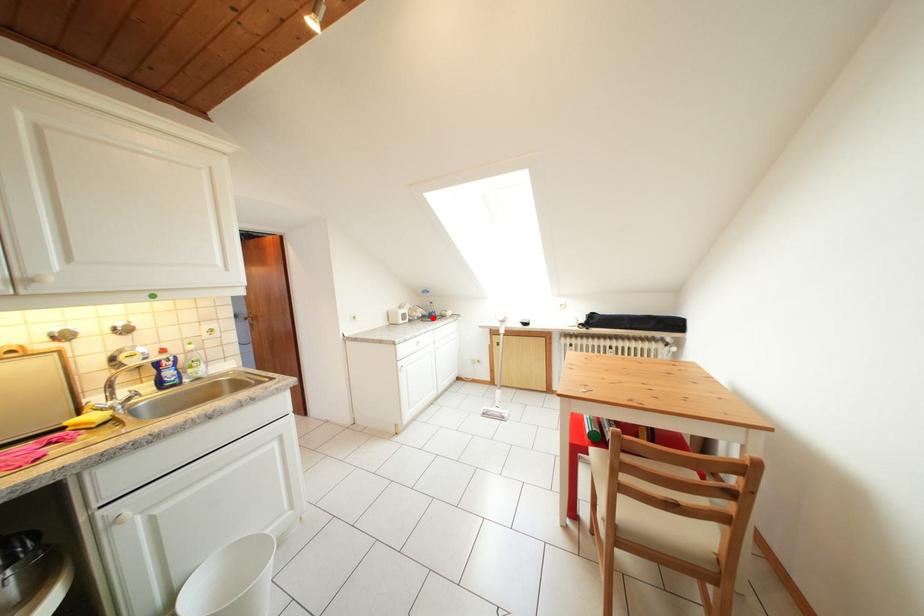
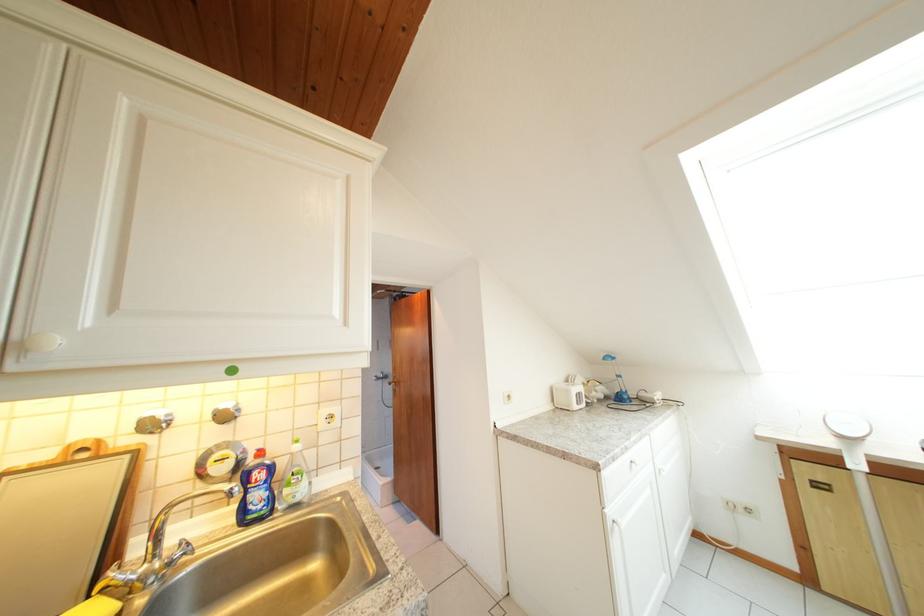
Find the pixel in the second image that matches the highlighted location in the first image.

(614, 397)